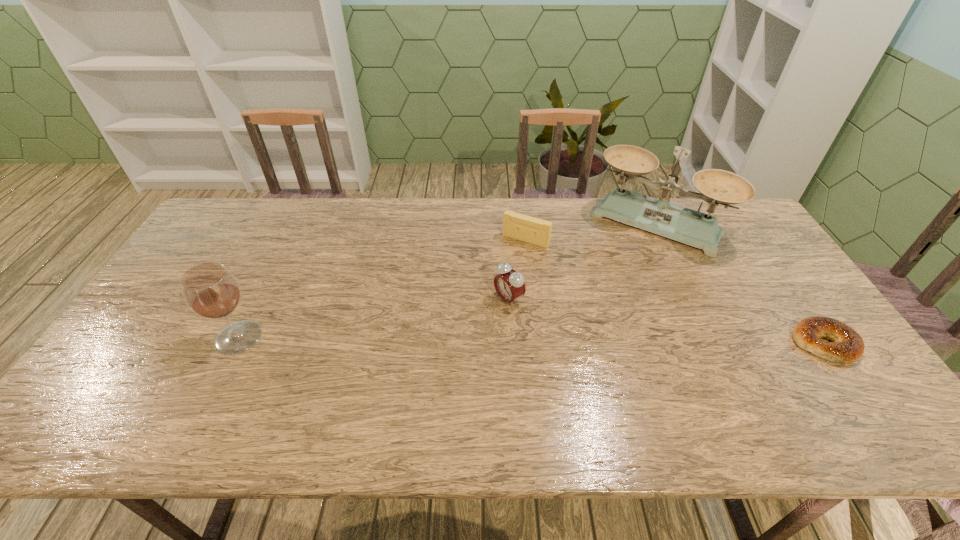
Find the location of `bagel that is at the right edge`. bagel that is at the right edge is located at coordinates (847, 345).

Identify the location of scale that is at the right edge. (659, 216).

Find the location of a particular element. The image size is (960, 540). object located at the far right corner is located at coordinates (659, 216).

The image size is (960, 540). What are the coordinates of `vacant space at the far edge of the desktop` in the screenshot? It's located at (277, 202).

The width and height of the screenshot is (960, 540). Identify the location of free space at the near edge of the desktop. (435, 394).

At what (x,y) coordinates should I click in order to perform the action: click on vacant space at the left edge of the desktop. Please return your answer as a coordinate pair (x, y). The width and height of the screenshot is (960, 540). Looking at the image, I should click on (181, 300).

This screenshot has width=960, height=540. What are the coordinates of `free region at the right edge` in the screenshot? It's located at (780, 287).

Find the location of a particular element. The image size is (960, 540). free region at the far left corner of the desktop is located at coordinates (242, 225).

Where is `vacant space at the near right corner`? Image resolution: width=960 pixels, height=540 pixels. vacant space at the near right corner is located at coordinates (814, 384).

Where is `free space between the leftmost object and the scale`? This screenshot has width=960, height=540. free space between the leftmost object and the scale is located at coordinates (447, 281).